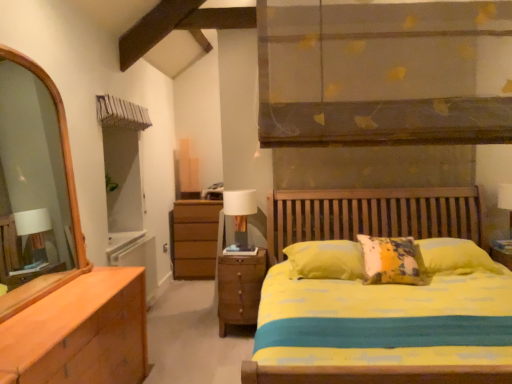
Question: Does wooden nightstand at lower center have a lesser height compared to white fabric-covered table lamp at center?

Choices:
 (A) yes
 (B) no

Answer: (B)

Question: From the image's perspective, is wooden nightstand at lower center beneath white fabric-covered table lamp at center?

Choices:
 (A) no
 (B) yes

Answer: (B)

Question: From a real-world perspective, is wooden nightstand at lower center on top of white fabric-covered table lamp at center?

Choices:
 (A) no
 (B) yes

Answer: (A)

Question: Does wooden nightstand at lower center have a greater width compared to white fabric-covered table lamp at center?

Choices:
 (A) no
 (B) yes

Answer: (B)

Question: Is wooden nightstand at lower center in contact with white fabric-covered table lamp at center?

Choices:
 (A) yes
 (B) no

Answer: (B)

Question: From a real-world perspective, is wooden nightstand at lower center located beneath white fabric-covered table lamp at center?

Choices:
 (A) yes
 (B) no

Answer: (A)

Question: Can you confirm if white fabric-covered table lamp at center is taller than wooden nightstand at lower center?

Choices:
 (A) no
 (B) yes

Answer: (A)

Question: Does white fabric-covered table lamp at center come behind wooden nightstand at lower center?

Choices:
 (A) no
 (B) yes

Answer: (B)

Question: Considering the relative sizes of white fabric-covered table lamp at center and wooden nightstand at lower center in the image provided, is white fabric-covered table lamp at center bigger than wooden nightstand at lower center?

Choices:
 (A) no
 (B) yes

Answer: (A)

Question: Is white fabric-covered table lamp at center to the right of wooden nightstand at lower center from the viewer's perspective?

Choices:
 (A) yes
 (B) no

Answer: (B)

Question: Can you confirm if white fabric-covered table lamp at center is smaller than wooden nightstand at lower center?

Choices:
 (A) yes
 (B) no

Answer: (A)

Question: Does white fabric-covered table lamp at center appear on the left side of wooden nightstand at lower center?

Choices:
 (A) yes
 (B) no

Answer: (A)

Question: In terms of width, does white fabric-covered table lamp at center look wider or thinner when compared to wooden nightstand at lower center?

Choices:
 (A) wide
 (B) thin

Answer: (B)